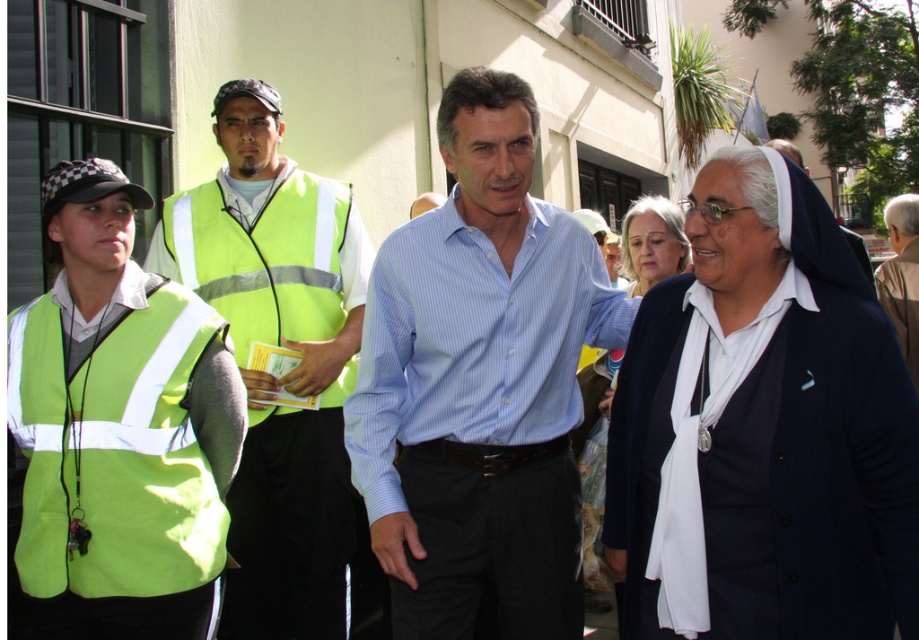
Is blue striped shirt at center above high-visibility fabric safety vest at center?

Actually, blue striped shirt at center is below high-visibility fabric safety vest at center.

Is point (509, 285) positioned before point (331, 308)?

Yes, it is in front of point (331, 308).

At what (x,y) coordinates should I click in order to perform the action: click on blue striped shirt at center. Please return your answer as a coordinate pair (x, y). The image size is (919, 640). Looking at the image, I should click on (479, 385).

Looking at this image, who is higher up, high visibility vest at center or brown leather jacket at upper right?

brown leather jacket at upper right

Is high visibility vest at center shorter than brown leather jacket at upper right?

Yes, high visibility vest at center is shorter than brown leather jacket at upper right.

This screenshot has width=919, height=640. What are the coordinates of `high visibility vest at center` in the screenshot? It's located at (275, 348).

Is white matte nun's habit at center positioned in front of high visibility vest at center?

That is True.

Does point (796, 205) come farther from viewer compared to point (252, 276)?

No, it is not.

Locate an element on the screen. The image size is (919, 640). white matte nun's habit at center is located at coordinates (766, 428).